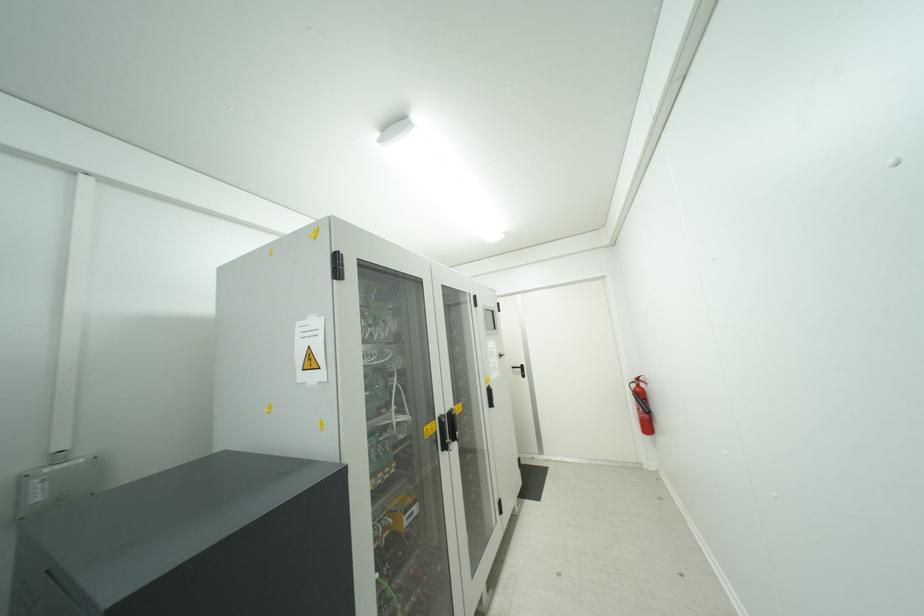
Identify the location of black door handle. The image size is (924, 616). [519, 370].